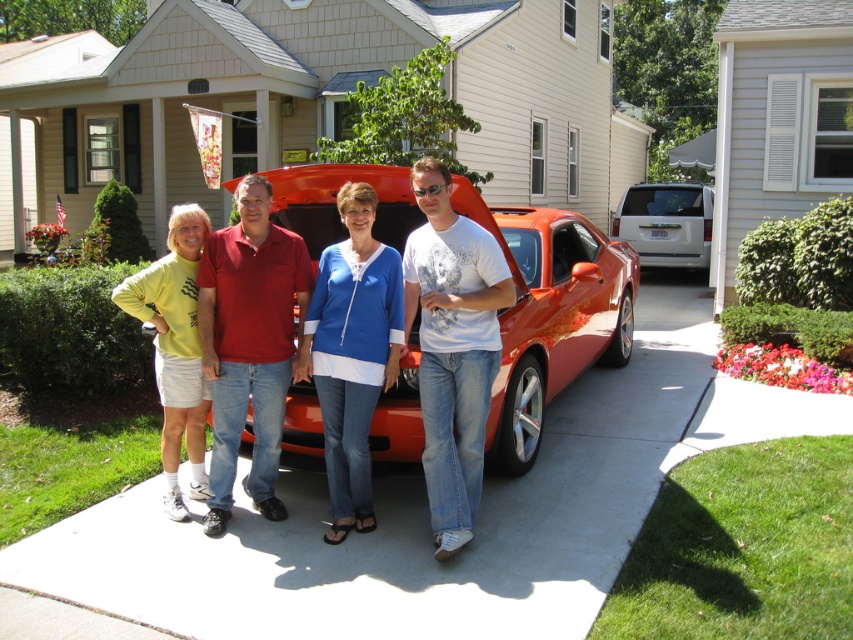
Does white printed t-shirt at center have a smaller size compared to blue denim jeans at center?

Incorrect, white printed t-shirt at center is not smaller in size than blue denim jeans at center.

Does point (422, 452) lie in front of point (338, 467)?

Yes, it is in front of point (338, 467).

Is point (427, 314) farther from camera compared to point (363, 529)?

No.

The image size is (853, 640). I want to click on white printed t-shirt at center, so click(451, 348).

Which is behind, point (193, 284) or point (669, 248)?

Positioned behind is point (669, 248).

Does point (136, 292) come in front of point (689, 266)?

Yes, point (136, 292) is closer to viewer.

You are a GUI agent. You are given a task and a screenshot of the screen. Output one action in this format:
    pyautogui.click(x=<x>, y=<y>)
    Task: Click on the matte yellow t-shirt at left
    The width and height of the screenshot is (853, 640).
    Given the screenshot: What is the action you would take?
    pyautogui.click(x=175, y=348)

How much distance is there between white printed t-shirt at center and matte yellow t-shirt at left?

They are 5.21 feet apart.

Can you confirm if white printed t-shirt at center is smaller than matte yellow t-shirt at left?

No, white printed t-shirt at center is not smaller than matte yellow t-shirt at left.

Measure the distance between point (450, 212) and camera.

Point (450, 212) is 12.76 feet away from camera.

The height and width of the screenshot is (640, 853). I want to click on white printed t-shirt at center, so click(451, 348).